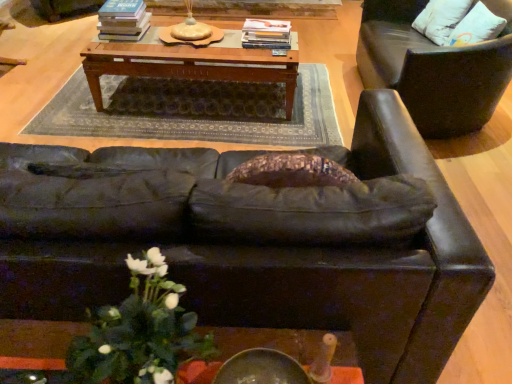
Identify the location of white cotton pillow at upper right. point(441,19).

What is the approximate height of white matte floral arrangement at lower left?

white matte floral arrangement at lower left is 13.51 inches tall.

The width and height of the screenshot is (512, 384). Describe the element at coordinates (191, 63) in the screenshot. I see `wooden table at center` at that location.

The image size is (512, 384). Identify the location of hardcover books at center, the 1th book from the left. (123, 20).

The height and width of the screenshot is (384, 512). What are the coordinates of `chair on the right side of white matte floral arrangement at lower left` in the screenshot? It's located at (433, 69).

From a real-world perspective, is leather chair at right below white matte floral arrangement at lower left?

Yes, from a real-world perspective, leather chair at right is below white matte floral arrangement at lower left.

Considering the points (438, 54) and (157, 342), which point is behind, point (438, 54) or point (157, 342)?

Point (438, 54)

Is wooden table at center to the left of hardcover books at center, the second book from the right, from the viewer's perspective?

Incorrect, wooden table at center is not on the left side of hardcover books at center, the second book from the right.

Is wooden table at center aimed at hardcover books at center, the second book from the right?

No.

Is the position of wooden table at center less distant than that of hardcover books at center, the second book from the right?

Yes, wooden table at center is closer to the viewer.

Can you confirm if wooden table at center is bigger than hardcover books at center, the second book from the right?

Correct, wooden table at center is larger in size than hardcover books at center, the second book from the right.

Could you tell me if white cotton pillow at upper right is turned towards hardcover book at center, acting as the 1th book starting from the right?

Yes, white cotton pillow at upper right is oriented towards hardcover book at center, acting as the 1th book starting from the right.

At what (x,y) coordinates should I click in order to perform the action: click on book directly beneath the white cotton pillow at upper right (from a real-world perspective). Please return your answer as a coordinate pair (x, y). This screenshot has height=384, width=512. Looking at the image, I should click on (266, 34).

Considering the sizes of objects white cotton pillow at upper right and hardcover book at center, which appears as the 2th book when viewed from the left, in the image provided, who is thinner, white cotton pillow at upper right or hardcover book at center, which appears as the 2th book when viewed from the left,?

white cotton pillow at upper right is thinner.

Considering the relative positions of white cotton pillow at upper right and hardcover book at center, acting as the 1th book starting from the right, in the image provided, is white cotton pillow at upper right to the left of hardcover book at center, acting as the 1th book starting from the right, from the viewer's perspective?

Incorrect, white cotton pillow at upper right is not on the left side of hardcover book at center, acting as the 1th book starting from the right.

Considering the sizes of objects white cotton pillow at upper right and matte black couch at center in the image provided, who is taller, white cotton pillow at upper right or matte black couch at center?

matte black couch at center is taller.

How many degrees apart are the facing directions of white cotton pillow at upper right and matte black couch at center?

They differ by 101 degrees in their facing directions.

Looking at this image, does white cotton pillow at upper right have a larger size compared to matte black couch at center?

No.

Is white cotton pillow at upper right wider than matte black couch at center?

No, white cotton pillow at upper right is not wider than matte black couch at center.

Is hardcover books at center, the 1th book from the left, oriented away from wooden table at center?

hardcover books at center, the 1th book from the left, does not have its back to wooden table at center.

From a real-world perspective, is hardcover books at center, the 1th book from the left, on top of wooden table at center?

Indeed, from a real-world perspective, hardcover books at center, the 1th book from the left, stands above wooden table at center.

Is hardcover books at center, the 1th book from the left, bigger than wooden table at center?

Incorrect, hardcover books at center, the 1th book from the left, is not larger than wooden table at center.

From a real-world perspective, is matte black couch at center physically above white matte floral arrangement at lower left?

No, from a real-world perspective, matte black couch at center is not above white matte floral arrangement at lower left.

Can we say matte black couch at center lies outside white matte floral arrangement at lower left?

matte black couch at center is positioned outside white matte floral arrangement at lower left.

Is matte black couch at center looking in the opposite direction of white matte floral arrangement at lower left?

That's right, matte black couch at center is facing away from white matte floral arrangement at lower left.

Can you tell me how much matte black couch at center and white matte floral arrangement at lower left differ in facing direction?

The angular difference between matte black couch at center and white matte floral arrangement at lower left is 177 degrees.

Considering the sizes of objects white matte floral arrangement at lower left and wooden table at center in the image provided, who is wider, white matte floral arrangement at lower left or wooden table at center?

wooden table at center is wider.

Is the surface of white matte floral arrangement at lower left in direct contact with wooden table at center?

white matte floral arrangement at lower left is not next to wooden table at center, and they're not touching.

Which of these two, white matte floral arrangement at lower left or wooden table at center, stands shorter?

white matte floral arrangement at lower left is shorter.

Locate an element on the screen. Image resolution: width=512 pixels, height=384 pixels. chair above the white matte floral arrangement at lower left (from the image's perspective) is located at coordinates (433, 69).

Image resolution: width=512 pixels, height=384 pixels. What are the coordinates of `table that appears below the hardcover books at center, the second book from the right (from a real-world perspective)` in the screenshot? It's located at (191, 63).

Considering their positions, is hardcover book at center, which appears as the 2th book when viewed from the left, positioned further to wooden table at center than white cotton pillow at upper right?

white cotton pillow at upper right.

When comparing their distances from hardcover book at center, acting as the 1th book starting from the right, does white matte floral arrangement at lower left or wooden table at center seem closer?

wooden table at center is positioned closer to the anchor hardcover book at center, acting as the 1th book starting from the right.

Considering their positions, is leather chair at right positioned further to matte black couch at center than hardcover book at center, acting as the 1th book starting from the right?

hardcover book at center, acting as the 1th book starting from the right, is positioned further to the anchor matte black couch at center.

Considering their positions, is matte black couch at center positioned further to hardcover book at center, which appears as the 2th book when viewed from the left, than hardcover books at center, the 1th book from the left?

matte black couch at center is further to hardcover book at center, which appears as the 2th book when viewed from the left.

Estimate the real-world distances between objects in this image. Which object is closer to matte black couch at center, wooden table at center or white cotton pillow at upper right?

wooden table at center.

From the picture: Which object lies further to the anchor point hardcover books at center, the 1th book from the left, hardcover book at center, which appears as the 2th book when viewed from the left, or matte black couch at center?

→ The object further to hardcover books at center, the 1th book from the left, is matte black couch at center.

Estimate the real-world distances between objects in this image. Which object is closer to white matte floral arrangement at lower left, leather chair at right or hardcover books at center, the second book from the right?

leather chair at right lies closer to white matte floral arrangement at lower left than the other object.

When comparing their distances from matte black couch at center, does leather chair at right or white cotton pillow at upper right seem closer?

leather chair at right lies closer to matte black couch at center than the other object.

Locate an element on the screen. The width and height of the screenshot is (512, 384). chair between wooden table at center and white cotton pillow at upper right in the horizontal direction is located at coordinates (433, 69).

At what (x,y) coordinates should I click in order to perform the action: click on studio couch between white matte floral arrangement at lower left and hardcover books at center, the 1th book from the left, in the front-back direction. Please return your answer as a coordinate pair (x, y). Looking at the image, I should click on (264, 246).

What are the coordinates of `book located between wooden table at center and white cotton pillow at upper right in the left-right direction` in the screenshot? It's located at (266, 34).

At what (x,y) coordinates should I click in order to perform the action: click on studio couch positioned between white matte floral arrangement at lower left and white cotton pillow at upper right from near to far. Please return your answer as a coordinate pair (x, y). Looking at the image, I should click on point(264,246).